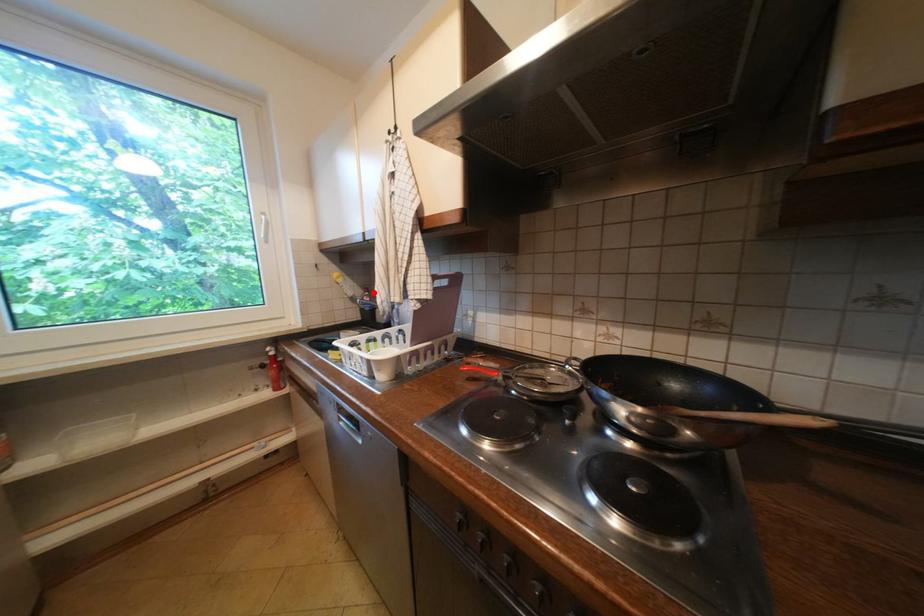
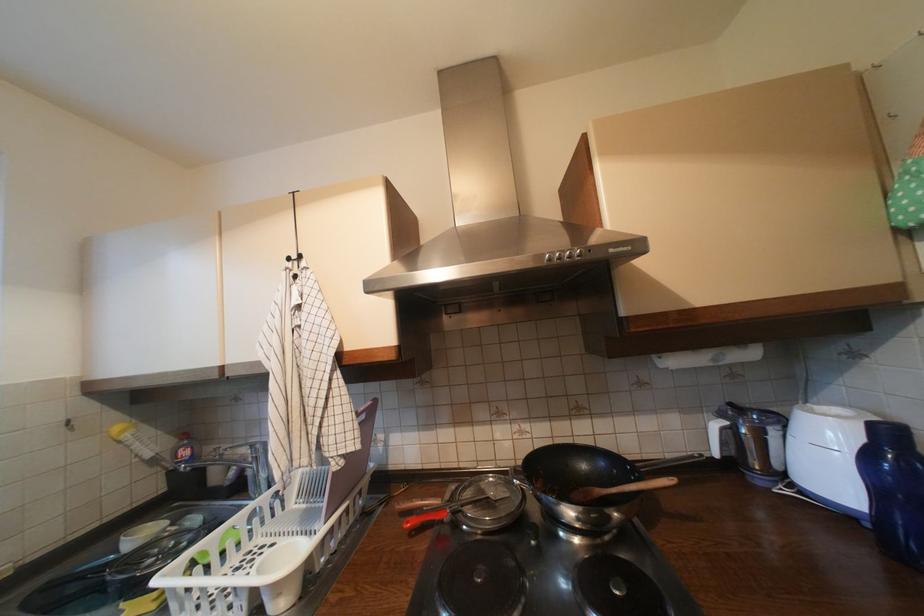
In the second image, find the point that corresponds to the highlighted location in the first image.

(189, 440)